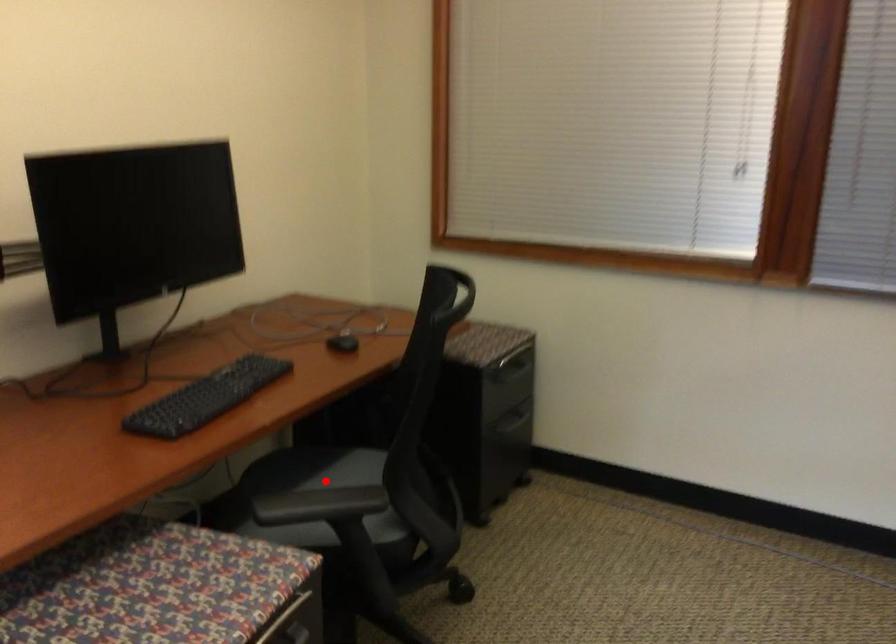
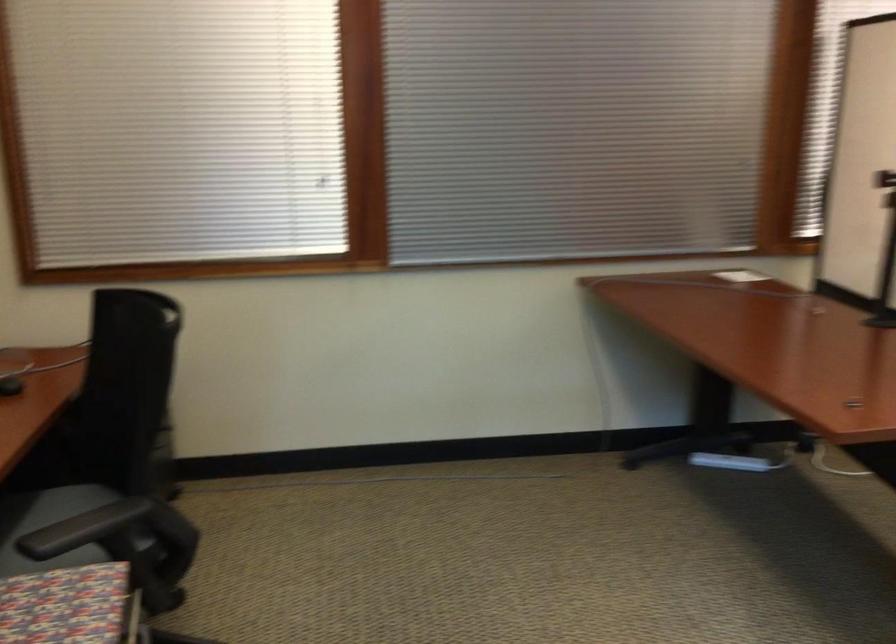
The point at the highlighted location is marked in the first image. Where is the corresponding point in the second image?

(47, 525)